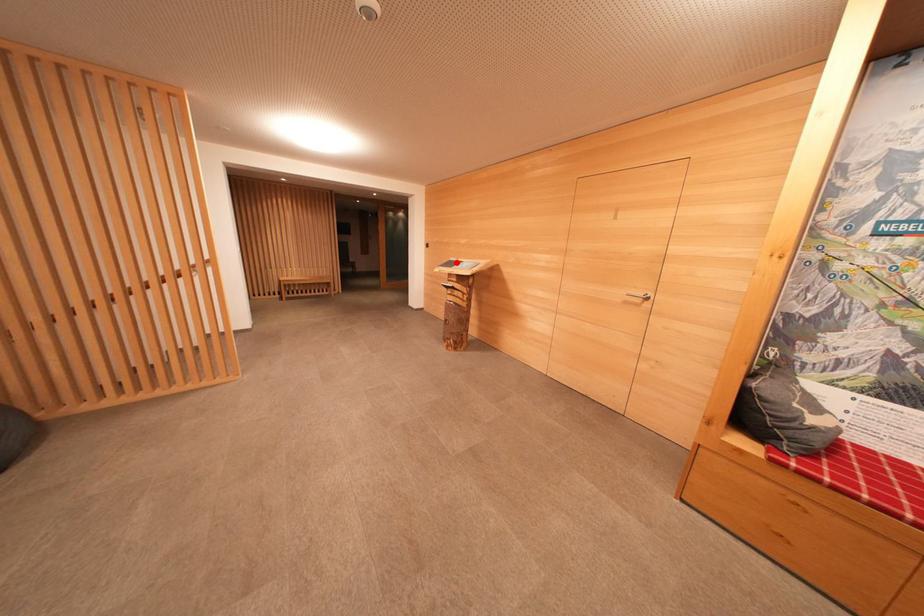
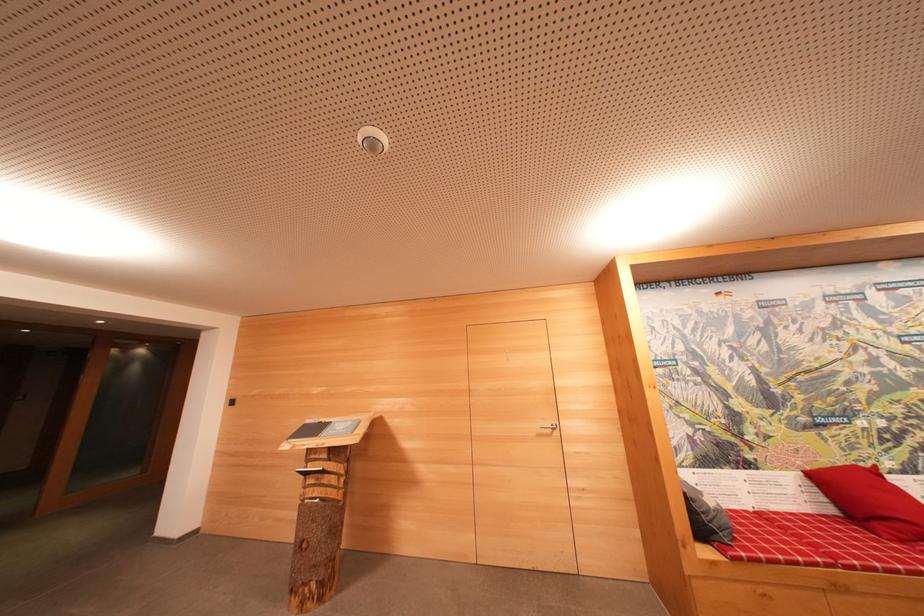
In the second image, find the point that corresponds to the highlighted location in the first image.

(311, 424)